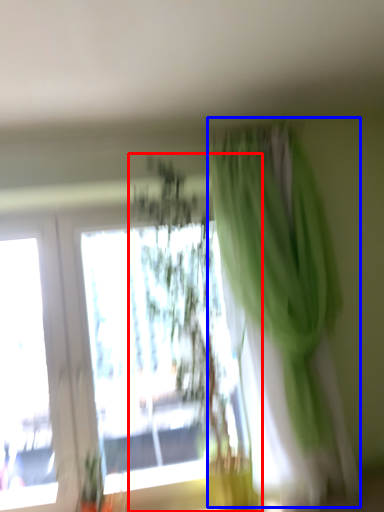
Question: Which of the following is the closest to the observer, houseplant (highlighted by a red box) or curtain (highlighted by a blue box)?

Choices:
 (A) houseplant
 (B) curtain

Answer: (B)